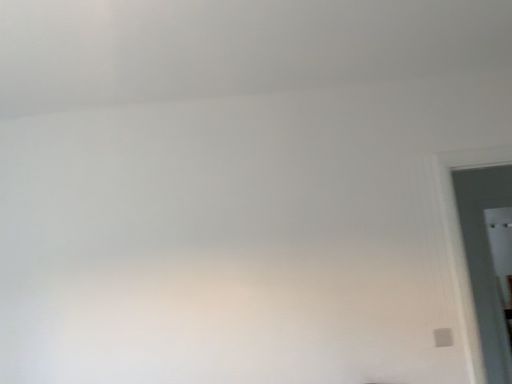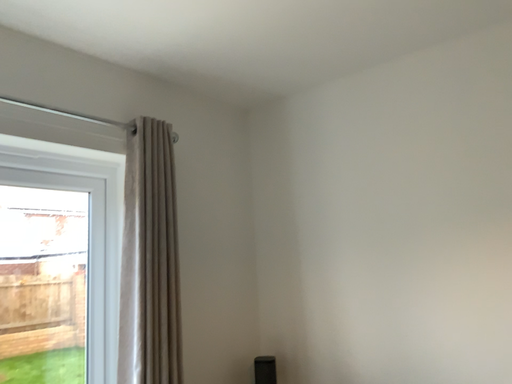
Question: Which way did the camera rotate in the video?

Choices:
 (A) rotated downward
 (B) rotated upward

Answer: (A)